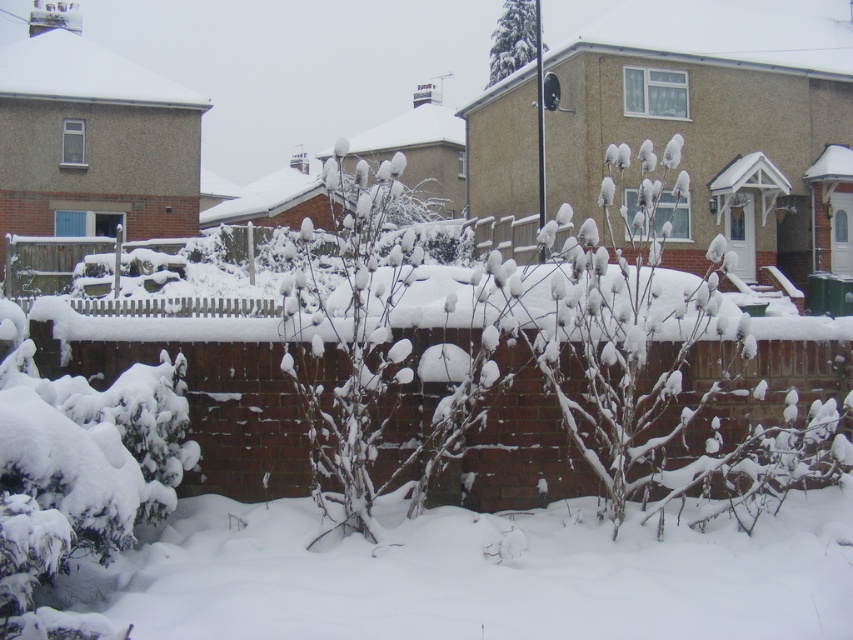
Question: Is snow-covered bush at lower left wider than green textured pine tree at upper center?

Choices:
 (A) no
 (B) yes

Answer: (A)

Question: In this image, where is snow-covered bush at lower left located relative to green textured pine tree at upper center?

Choices:
 (A) below
 (B) above

Answer: (A)

Question: Which object is closer to the camera taking this photo?

Choices:
 (A) green textured pine tree at upper center
 (B) snow-covered bush at lower left

Answer: (B)

Question: Does snow-covered bush at lower left appear under green textured pine tree at upper center?

Choices:
 (A) yes
 (B) no

Answer: (A)

Question: Which object appears closest to the camera in this image?

Choices:
 (A) green textured pine tree at upper center
 (B) snow-covered bush at lower left

Answer: (B)

Question: Which of the following is the closest to the observer?

Choices:
 (A) green textured pine tree at upper center
 (B) snow-covered bush at lower left

Answer: (B)